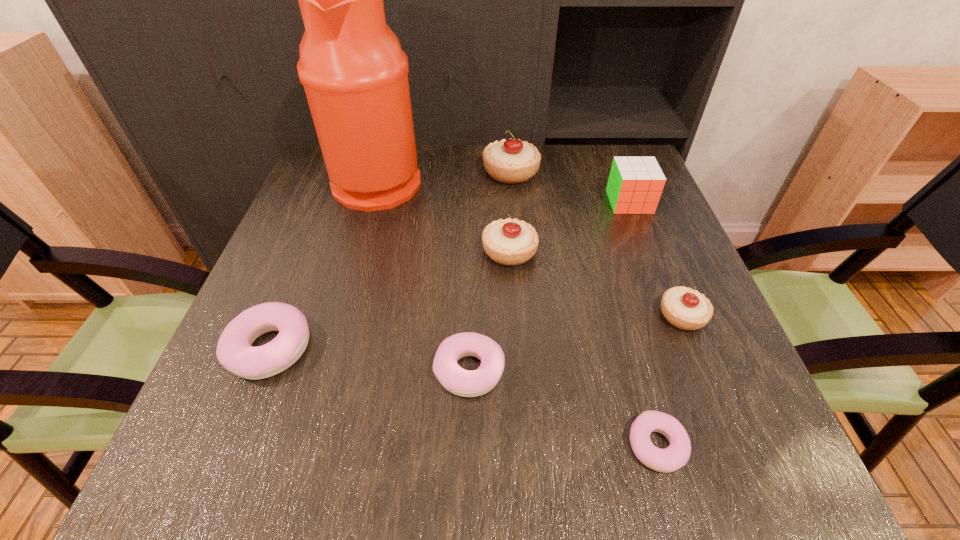
Identify the location of free region located on the right of the leftmost pink pastry. (458, 348).

Image resolution: width=960 pixels, height=540 pixels. I want to click on vacant space positioned 0.390m on the back of the second smallest pink pastry, so click(472, 210).

Locate an element on the screen. This screenshot has height=540, width=960. free space located 0.370m on the back of the smallest pink pastry is located at coordinates (603, 256).

The image size is (960, 540). I want to click on water jug that is at the far edge, so click(355, 74).

Where is `pastry that is positioned at the far edge`? The width and height of the screenshot is (960, 540). pastry that is positioned at the far edge is located at coordinates (511, 161).

Locate an element on the screen. This screenshot has height=540, width=960. cube at the far edge is located at coordinates (635, 185).

The width and height of the screenshot is (960, 540). I want to click on object at the near edge, so click(676, 455).

Where is `water jug located in the left edge section of the desktop`? water jug located in the left edge section of the desktop is located at coordinates (355, 74).

Locate an element on the screen. pastry located in the left edge section of the desktop is located at coordinates pyautogui.click(x=234, y=351).

Locate an element on the screen. The image size is (960, 540). cube located at the right edge is located at coordinates [x=635, y=185].